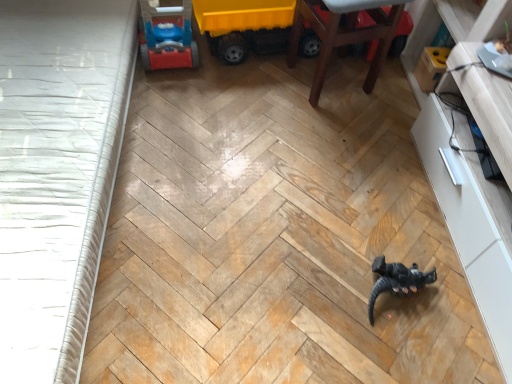
Question: Would you say white glossy dresser at right is outside wooden chair at upper right?

Choices:
 (A) no
 (B) yes

Answer: (B)

Question: Can you confirm if white glossy dresser at right is thinner than wooden chair at upper right?

Choices:
 (A) yes
 (B) no

Answer: (B)

Question: Is white glossy dresser at right surrounding wooden chair at upper right?

Choices:
 (A) yes
 (B) no

Answer: (B)

Question: Is white glossy dresser at right wider than wooden chair at upper right?

Choices:
 (A) no
 (B) yes

Answer: (B)

Question: Can you confirm if white glossy dresser at right is bigger than wooden chair at upper right?

Choices:
 (A) yes
 (B) no

Answer: (A)

Question: Can you see white glossy dresser at right touching wooden chair at upper right?

Choices:
 (A) no
 (B) yes

Answer: (A)

Question: From a real-world perspective, is wooden chair at upper right located beneath black matte dinosaur at center, which is the 2th toy in top-to-bottom order?

Choices:
 (A) no
 (B) yes

Answer: (A)

Question: Is wooden chair at upper right placed right next to black matte dinosaur at center, which is the 2th toy from back to front?

Choices:
 (A) yes
 (B) no

Answer: (B)

Question: Is wooden chair at upper right to the left of black matte dinosaur at center, the first toy positioned from the bottom, from the viewer's perspective?

Choices:
 (A) yes
 (B) no

Answer: (A)

Question: Is wooden chair at upper right outside black matte dinosaur at center, which is the 2th toy in top-to-bottom order?

Choices:
 (A) no
 (B) yes

Answer: (B)

Question: Considering the relative sizes of wooden chair at upper right and black matte dinosaur at center, which is the 2th toy in top-to-bottom order, in the image provided, is wooden chair at upper right bigger than black matte dinosaur at center, which is the 2th toy in top-to-bottom order,?

Choices:
 (A) no
 (B) yes

Answer: (B)

Question: Is wooden chair at upper right not near black matte dinosaur at center, which is the 2th toy from back to front?

Choices:
 (A) no
 (B) yes

Answer: (A)

Question: Is yellow plastic toy truck at upper center, acting as the first toy starting from the top, directly adjacent to black matte dinosaur at center, the 1th toy when ordered from right to left?

Choices:
 (A) no
 (B) yes

Answer: (A)